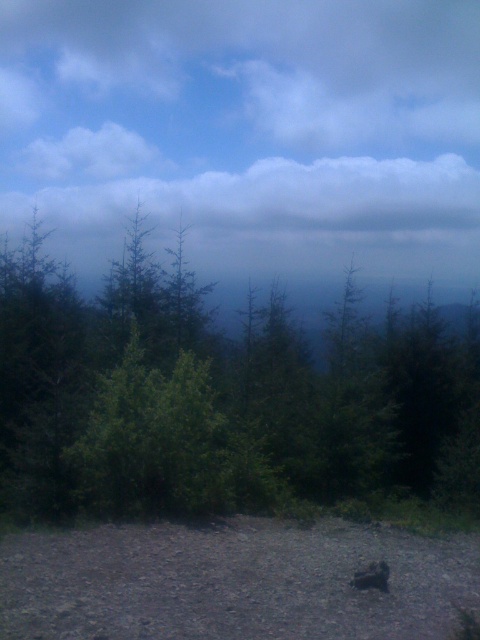
Question: Which of the following is the farthest from the observer?

Choices:
 (A) (369, 577)
 (B) (71, 372)

Answer: (B)

Question: Does green matte forest at center have a smaller size compared to brown furry dog at lower center?

Choices:
 (A) no
 (B) yes

Answer: (A)

Question: Is green matte forest at center positioned in front of brown furry dog at lower center?

Choices:
 (A) no
 (B) yes

Answer: (A)

Question: Does green matte forest at center lie behind brown furry dog at lower center?

Choices:
 (A) no
 (B) yes

Answer: (B)

Question: Which object is closer to the camera taking this photo?

Choices:
 (A) green matte forest at center
 (B) brown furry dog at lower center

Answer: (B)